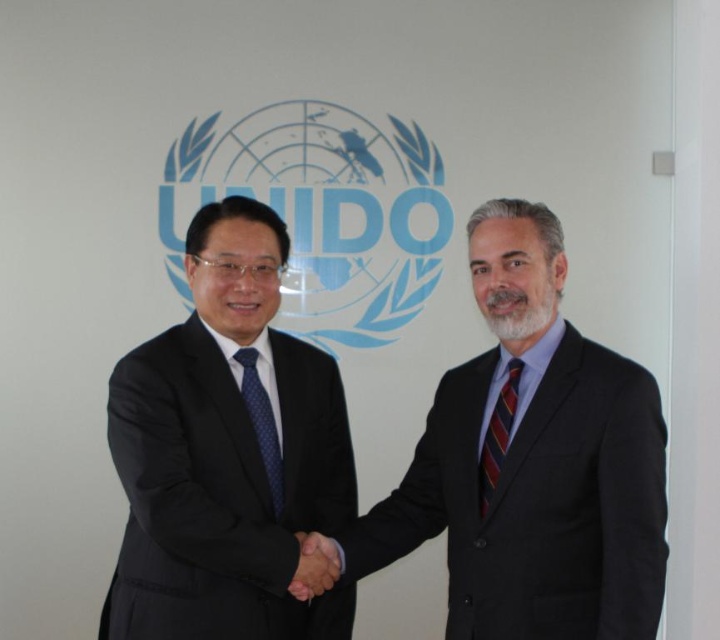
Question: Is blue dotted tie at center positioned behind smooth skin handshake at center?

Choices:
 (A) no
 (B) yes

Answer: (B)

Question: Which of the following is the closest to the observer?

Choices:
 (A) (248, 625)
 (B) (500, 467)
 (C) (464, 496)

Answer: (B)

Question: Is striped silk tie at right positioned in front of smooth skin handshake at center?

Choices:
 (A) yes
 (B) no

Answer: (A)

Question: Can you confirm if dark suit at center is thinner than striped silk tie at right?

Choices:
 (A) yes
 (B) no

Answer: (B)

Question: Which point appears farthest from the camera in this image?

Choices:
 (A) (198, 291)
 (B) (266, 442)
 (C) (305, 545)
 (D) (500, 406)

Answer: (A)

Question: Among these objects, which one is farthest from the camera?

Choices:
 (A) black suit at left
 (B) smooth skin handshake at center
 (C) striped silk tie at right
 (D) blue dotted tie at center

Answer: (D)